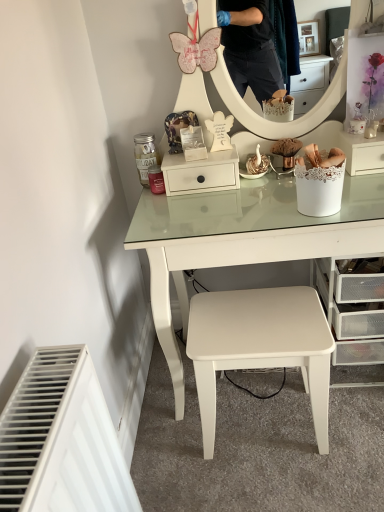
Image resolution: width=384 pixels, height=512 pixels. Identify the location of free point above white matte stool at center (from a real-world perspective). (252, 320).